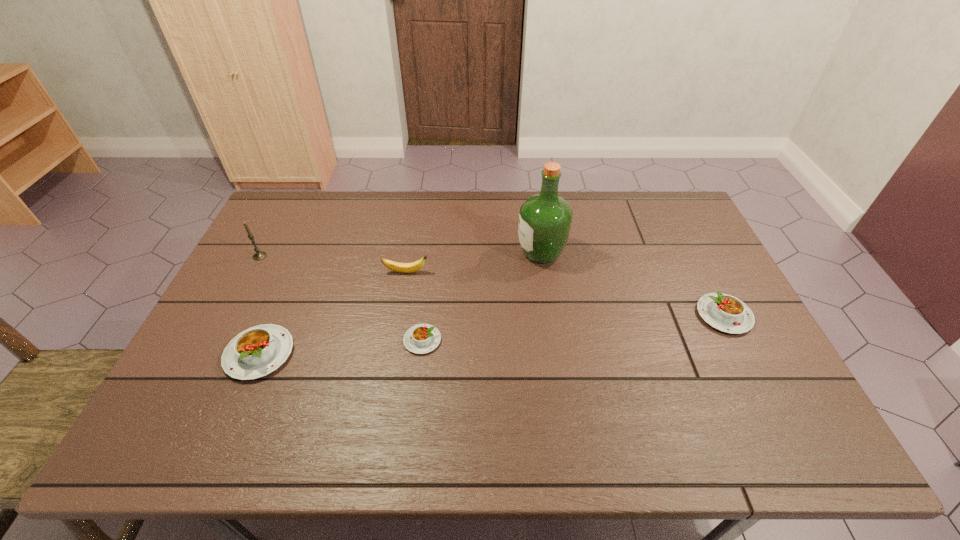
At what (x,y) coordinates should I click in order to perform the action: click on the second object from left to right. Please return your answer as a coordinate pair (x, y). Image resolution: width=960 pixels, height=540 pixels. Looking at the image, I should click on (256, 352).

Where is `the second pudding from right to left`? The height and width of the screenshot is (540, 960). the second pudding from right to left is located at coordinates (422, 338).

What are the coordinates of `the shortest object` in the screenshot? It's located at (422, 338).

Where is `the fifth tallest object`? The image size is (960, 540). the fifth tallest object is located at coordinates (726, 313).

At what (x,y) coordinates should I click in order to perform the action: click on the second shortest pudding. Please return your answer as a coordinate pair (x, y). The width and height of the screenshot is (960, 540). Looking at the image, I should click on (726, 313).

Locate an element on the screen. The width and height of the screenshot is (960, 540). candle is located at coordinates (259, 255).

This screenshot has height=540, width=960. In order to click on the leftmost object in this screenshot , I will do `click(259, 255)`.

Identify the location of the third farthest object. (417, 265).

Where is `the tallest object`? The height and width of the screenshot is (540, 960). the tallest object is located at coordinates (545, 219).

Locate an element on the screen. liquor is located at coordinates (545, 219).